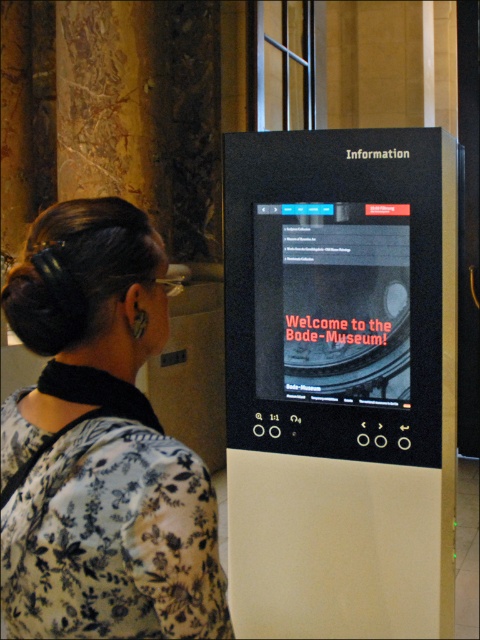
Question: Is black plastic information kiosk at center bigger than black floral dress at center?

Choices:
 (A) yes
 (B) no

Answer: (A)

Question: Which of the following is the farthest from the observer?

Choices:
 (A) (85, 586)
 (B) (277, 515)

Answer: (B)

Question: Is black plastic information kiosk at center bigger than black floral dress at center?

Choices:
 (A) no
 (B) yes

Answer: (B)

Question: Does black plastic information kiosk at center appear over black floral dress at center?

Choices:
 (A) no
 (B) yes

Answer: (A)

Question: Among these objects, which one is farthest from the camera?

Choices:
 (A) black plastic information kiosk at center
 (B) black floral dress at center

Answer: (A)